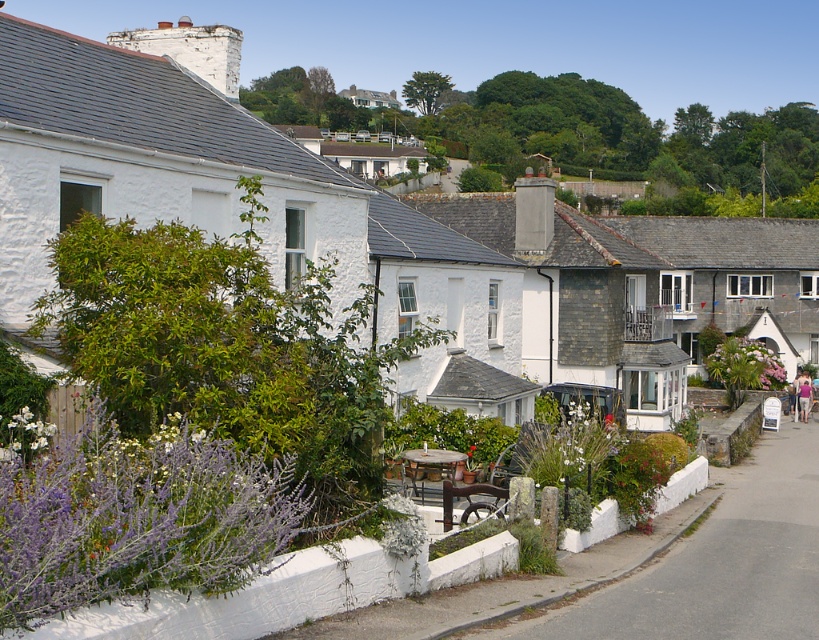
Question: Among these points, which one is nearest to the camera?

Choices:
 (A) (186, 45)
 (B) (810, 282)
 (C) (803, 380)
 (D) (577, 310)

Answer: (A)

Question: Which point is closer to the camera?

Choices:
 (A) gray slate roofed cottage at center
 (B) white stucco cottage at upper left
 (C) pink fabric at lower right

Answer: (B)

Question: Is white stucco cottage at upper left further to the viewer compared to white stone cottage at center?

Choices:
 (A) yes
 (B) no

Answer: (B)

Question: Does white stucco cottage at upper left have a larger size compared to gray slate roofed cottage at center?

Choices:
 (A) yes
 (B) no

Answer: (B)

Question: Does white stucco cottage at upper left appear under white stone cottage at center?

Choices:
 (A) no
 (B) yes

Answer: (A)

Question: Which object appears farthest from the camera in this image?

Choices:
 (A) gray slate roofed cottage at center
 (B) white stucco cottage at upper left
 (C) white stone cottage at center
 (D) pink fabric at lower right

Answer: (D)